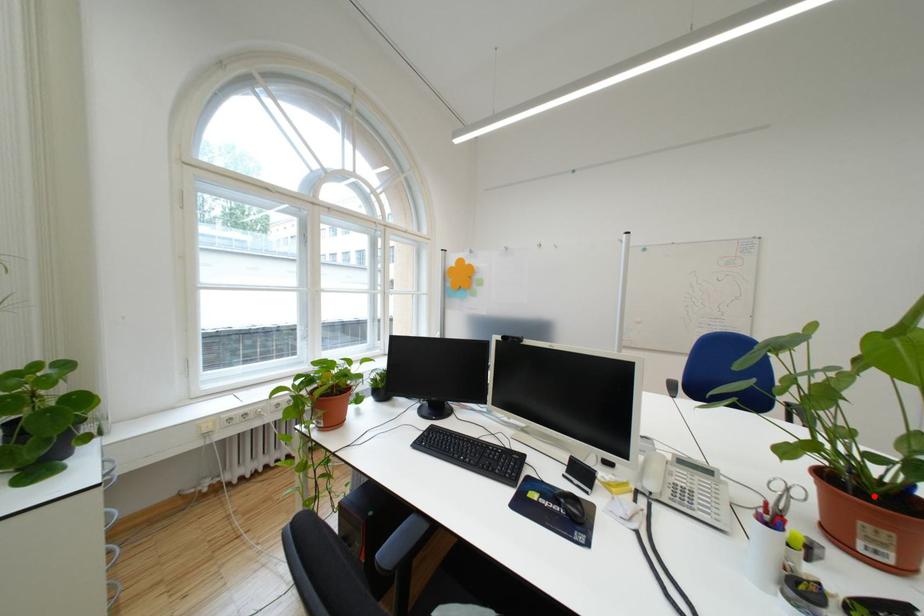
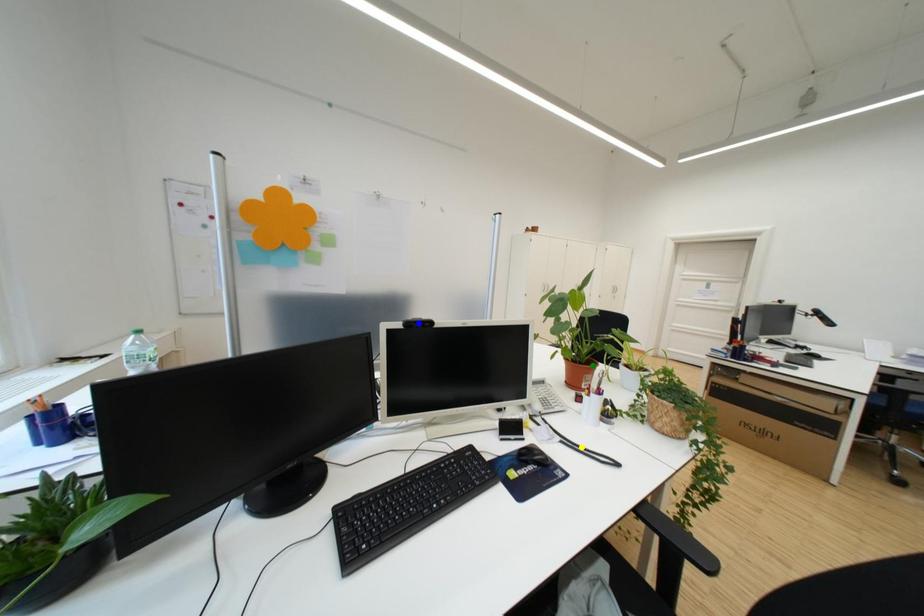
Question: I am providing you with two images of the same scene from different viewpoints. A red point is marked on the first image. You are given multiple points on the second image. Which point in image 2 represents the same 3d spot as the red point in image 1?

Choices:
 (A) yellow point
 (B) blue point
 (C) green point

Answer: (C)